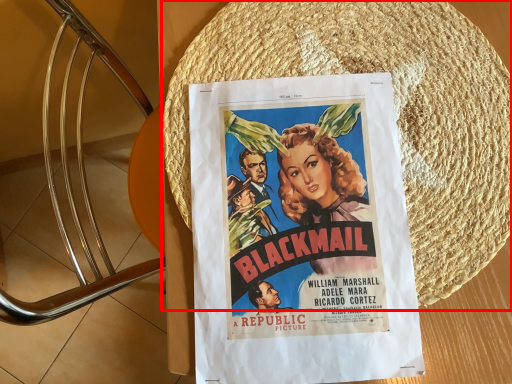
Question: From the image's perspective, where is straw hat (annotated by the red box) located relative to poster?

Choices:
 (A) below
 (B) above

Answer: (B)